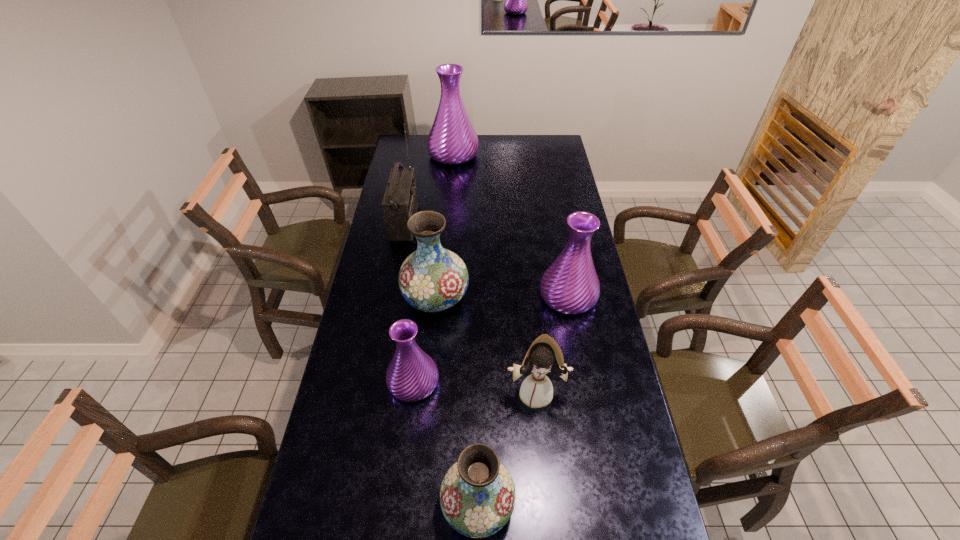
Where is `vacant area at the left edge`? Image resolution: width=960 pixels, height=540 pixels. vacant area at the left edge is located at coordinates (383, 388).

The image size is (960, 540). I want to click on free spot at the right edge of the desktop, so click(x=642, y=512).

In the image, there is a desktop. Where is `vacant space at the far right corner`? This screenshot has height=540, width=960. vacant space at the far right corner is located at coordinates (564, 156).

You are a GUI agent. You are given a task and a screenshot of the screen. Output one action in this format:
    pyautogui.click(x=<x>, y=<y>)
    Task: Click on the free space between the second nearest vase and the bigger blue vase
    This screenshot has width=960, height=540.
    Given the screenshot: What is the action you would take?
    coord(424,340)

Image resolution: width=960 pixels, height=540 pixels. I want to click on vacant space that's between the second farthest object and the rightmost vase, so click(x=487, y=259).

The image size is (960, 540). I want to click on free space between the bigger blue vase and the fourth farthest vase, so click(x=424, y=340).

Find the location of a particular element. Image resolution: width=960 pixels, height=540 pixels. unoccupied position between the bigger blue vase and the black doll is located at coordinates (486, 345).

Where is `unoccupied position between the farther blue vase and the doll`? unoccupied position between the farther blue vase and the doll is located at coordinates (486, 345).

Locate which object ranks third in proximity to the second nearest vase. Please provide its 2D coordinates. Your answer should be formatted as a tuple, i.e. [(x, y)], where the tuple contains the x and y coordinates of a point satisfying the conditions above.

[(545, 355)]

At what (x,y) coordinates should I click in order to perform the action: click on object that is the sixth closest to the radio receiver. Please return your answer as a coordinate pair (x, y). The image size is (960, 540). Looking at the image, I should click on (477, 496).